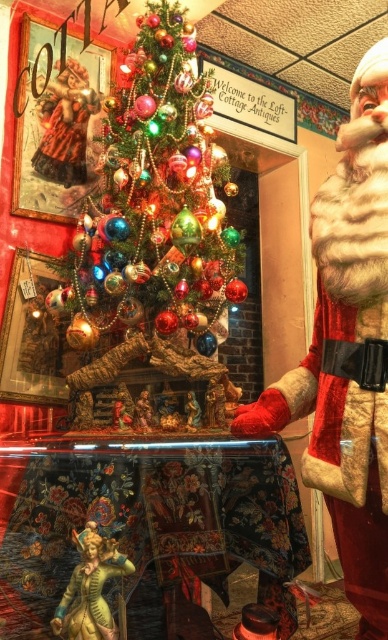
Is shiny glass ornaments at center positioned in front of gold metallic statue at lower left?

No, it is not.

I want to click on shiny glass ornaments at center, so click(x=155, y=202).

Does shiny glass ornaments at center have a lesser height compared to fuzzy fur santa at right?

In fact, shiny glass ornaments at center may be taller than fuzzy fur santa at right.

Can you confirm if shiny glass ornaments at center is smaller than fuzzy fur santa at right?

Actually, shiny glass ornaments at center might be larger than fuzzy fur santa at right.

Find the location of a particular element. This screenshot has width=388, height=640. shiny glass ornaments at center is located at coordinates (155, 202).

Locate an element on the screen. shiny glass ornaments at center is located at coordinates (155, 202).

Is point (358, 257) positioned in front of point (74, 593)?

That is True.

Is fuzzy fur santa at right smaller than gold metallic statue at lower left?

Incorrect, fuzzy fur santa at right is not smaller in size than gold metallic statue at lower left.

You are a GUI agent. You are given a task and a screenshot of the screen. Output one action in this format:
    pyautogui.click(x=<x>, y=<y>)
    Task: Click on the fuzzy fur santa at right
    This screenshot has height=640, width=388.
    Given the screenshot: What is the action you would take?
    pyautogui.click(x=348, y=352)

Find the location of a particular element. fuzzy fur santa at right is located at coordinates (348, 352).